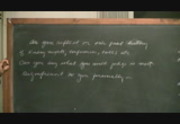
The height and width of the screenshot is (124, 180). I want to click on wood frame, so click(103, 19), click(11, 37).